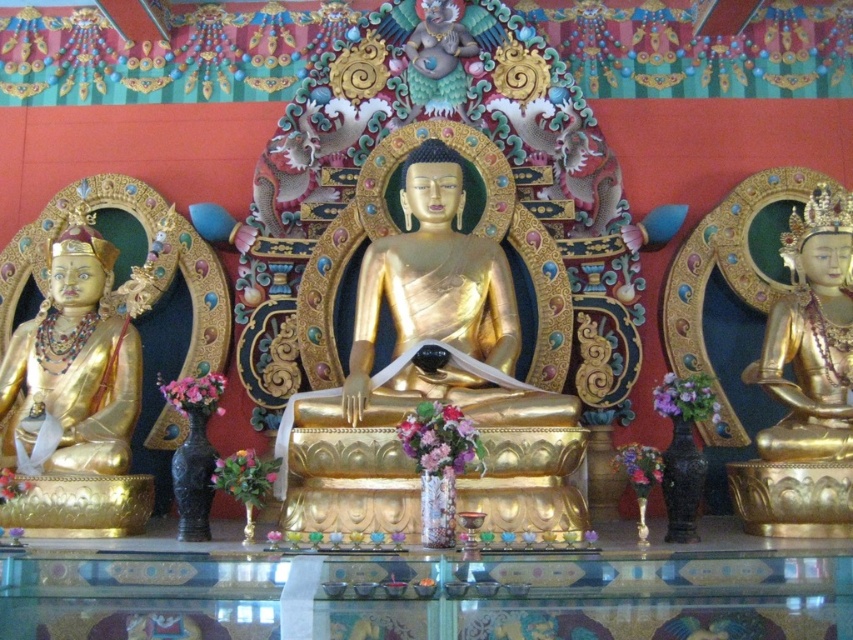
You are an art conservator assessing the altar. You need to determine if the gold polished statue at center can be safely moved to the right position currently occupied by the gold polished statue at right. Considering their sizes, is this feasible?

The gold polished statue at center is much taller than the gold polished statue at right. Moving it to the right position may not be feasible due to its greater height, which could cause instability or require adjustments to the altar structure.